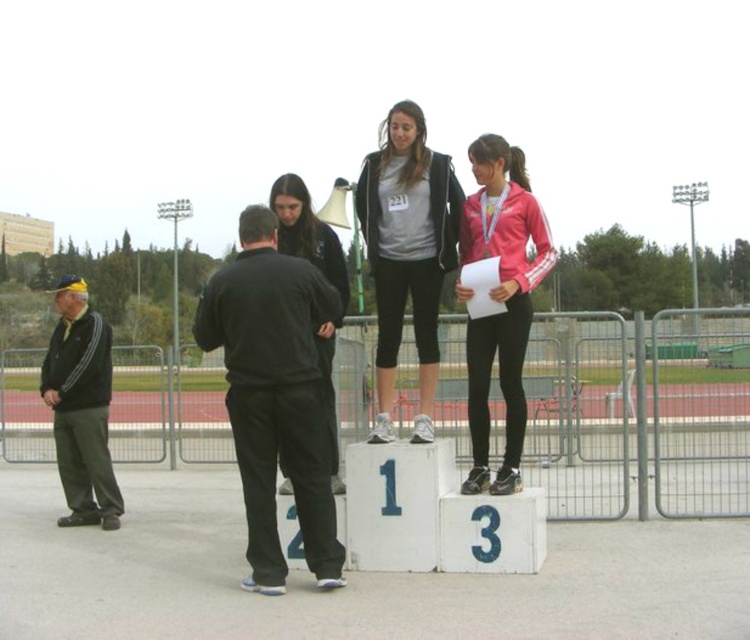
You are standing at the point labeled as point [501,300] in the image. What object are you currently standing on?

You are standing on the pink matte jacket at center, as the point [501,300] is located on it.

Where is the matte gray hoodie at center located in the image?

The matte gray hoodie at center is located at point (408, 252).

You are a photographer at the sports event and need to capture a photo of the black matte pants at center and the black fabric jacket at left. From the photographer perspective, which object is higher in the image?

The black matte pants at center is located above the black fabric jacket at left, so it appears higher in the image.